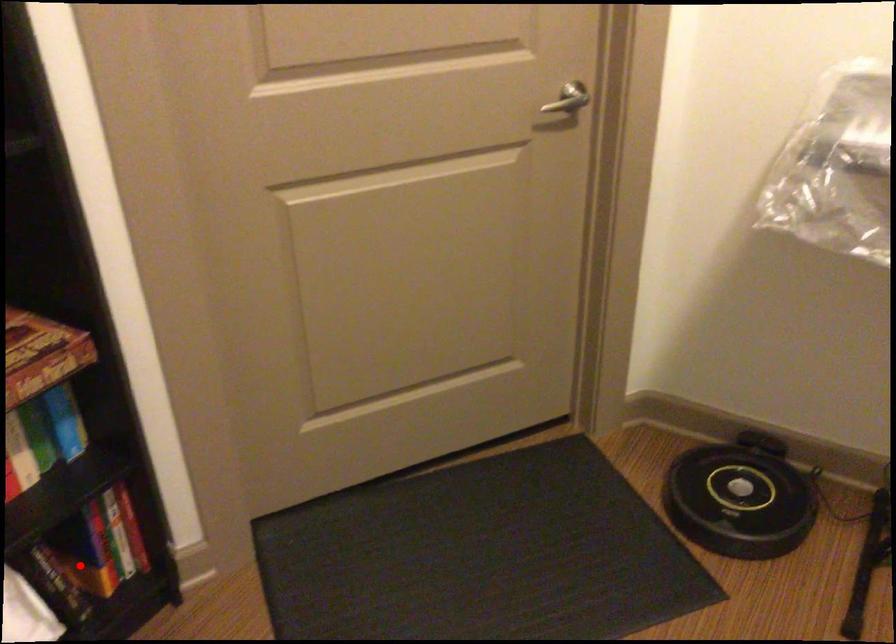
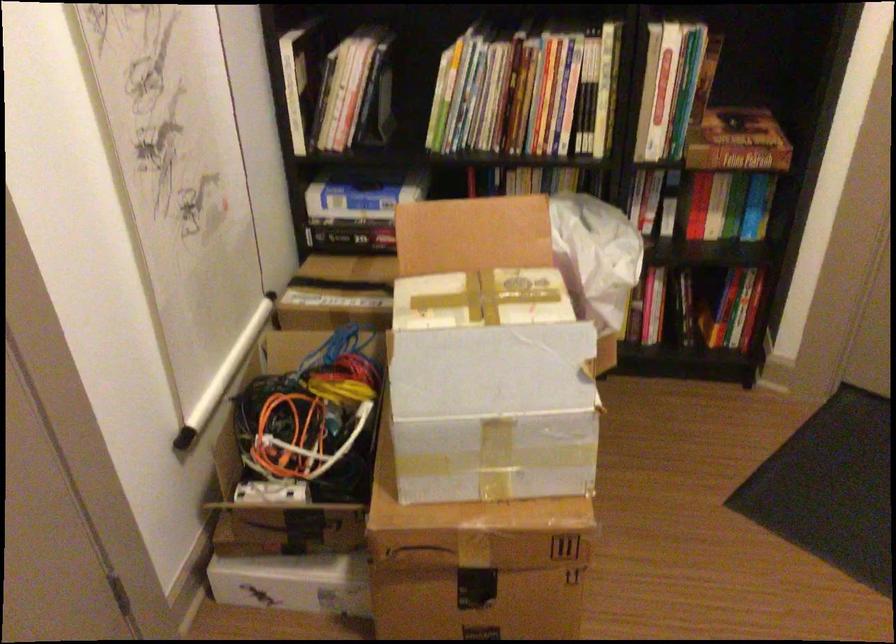
Locate, in the second image, the point that corresponds to the highlighted location in the first image.

(695, 307)